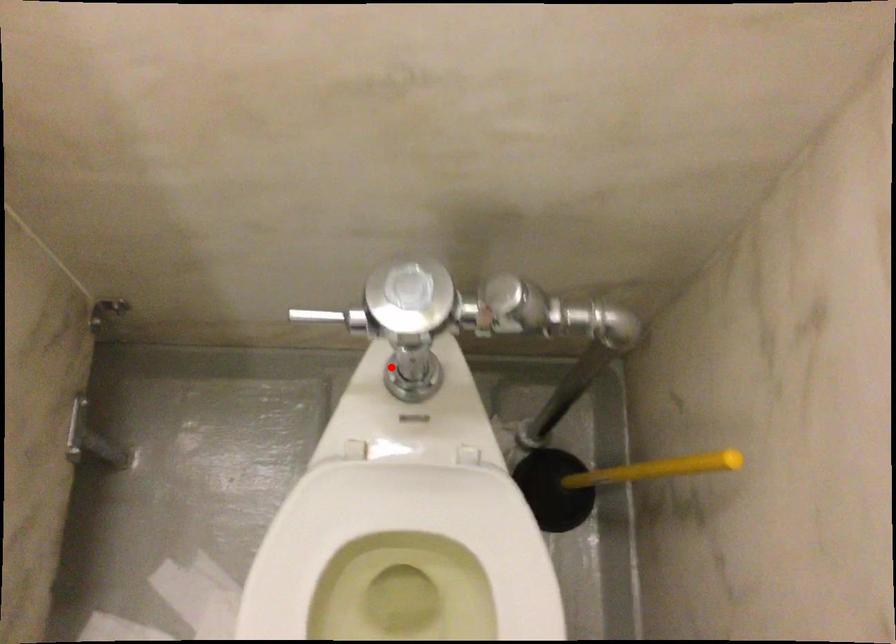
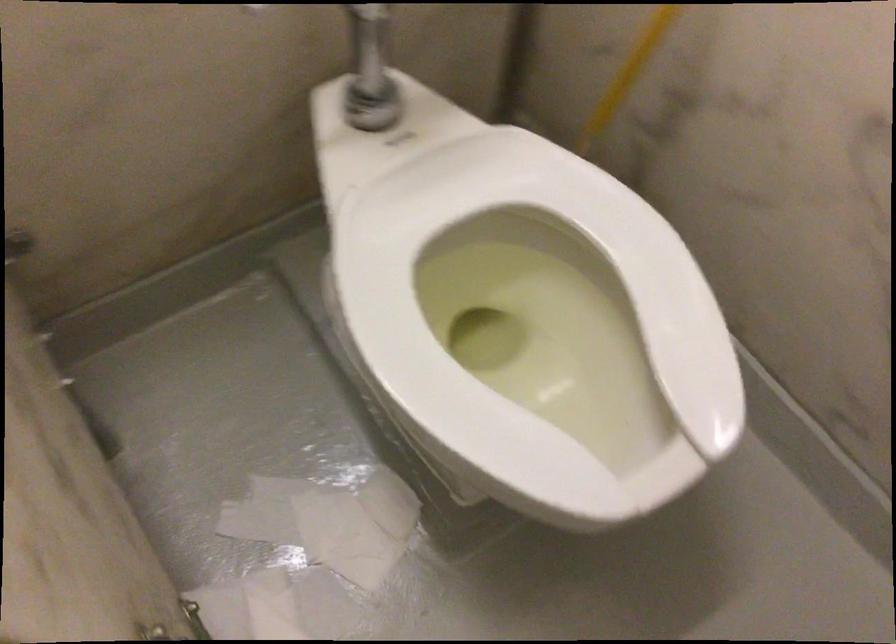
The point at the highlighted location is marked in the first image. Where is the corresponding point in the second image?

(362, 96)